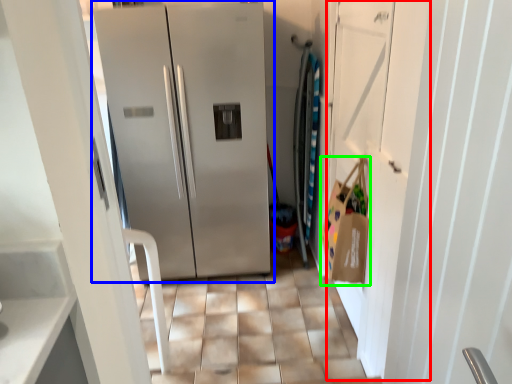
Question: Which object is positioned closest to door (highlighted by a red box)? Select from refrigerator (highlighted by a blue box) and shopping bag (highlighted by a green box).

Choices:
 (A) refrigerator
 (B) shopping bag

Answer: (B)